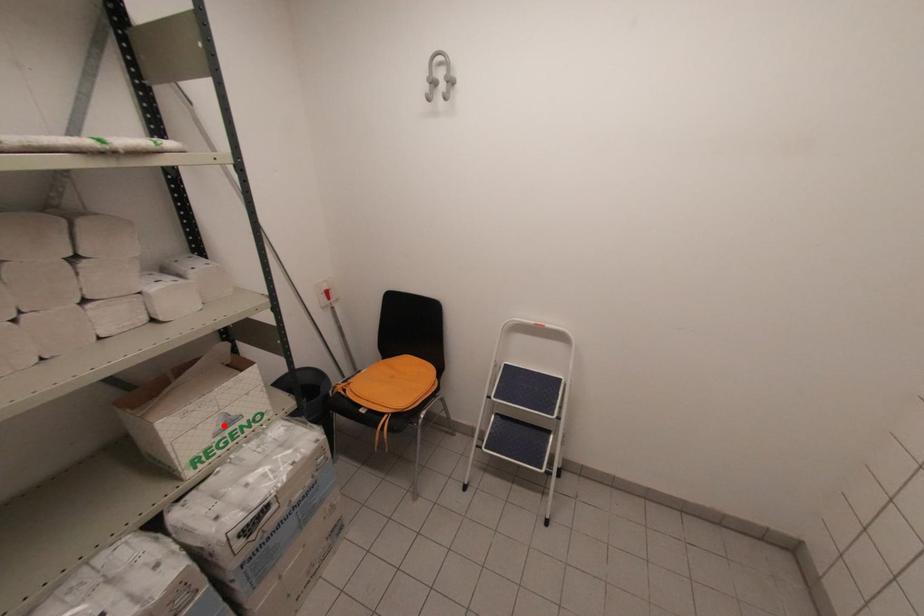
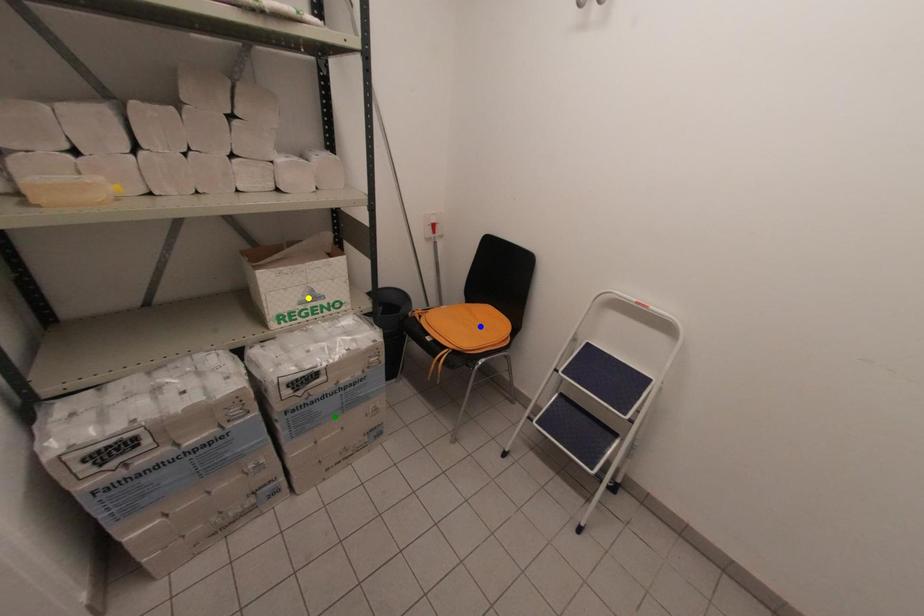
Question: I am providing you with two images of the same scene from different viewpoints. A red point is marked on the first image. You are given multiple points on the second image. Which spot in image 2 lines up with the point in image 1?

Choices:
 (A) yellow point
 (B) blue point
 (C) green point

Answer: (A)